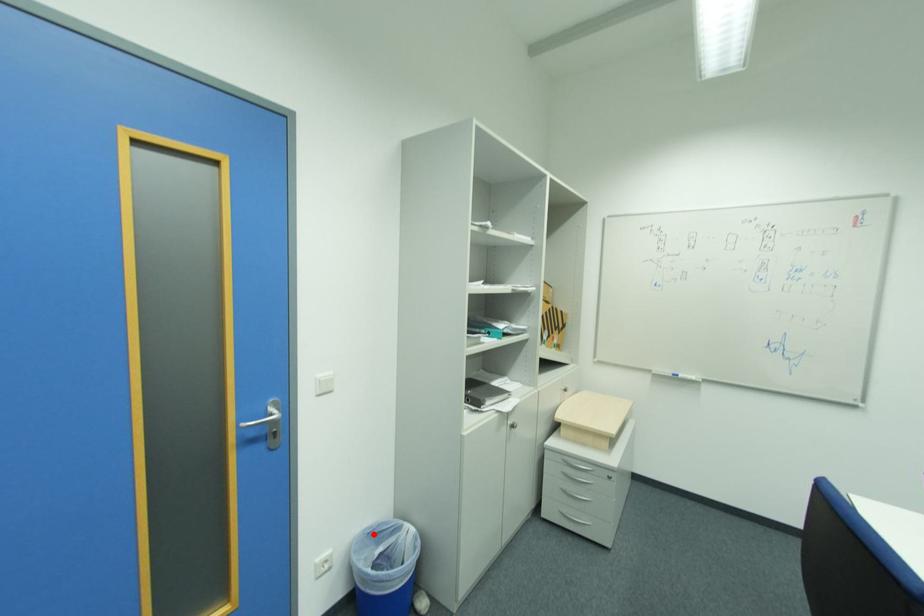
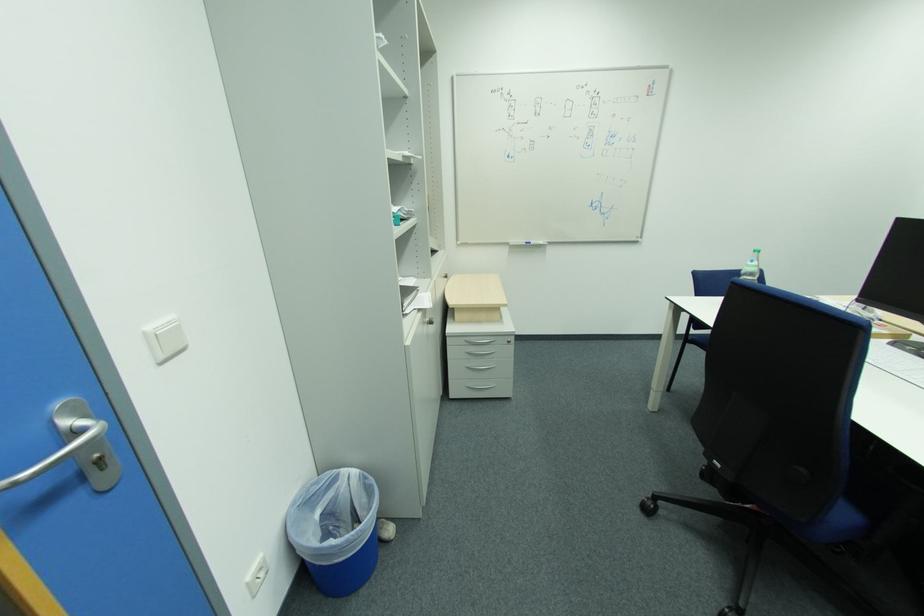
Question: I am providing you with two images of the same scene from different viewpoints. In image1, a red point is highlighted. Considering the same 3D point in image2, which of the following is correct?

Choices:
 (A) It is closer
 (B) It is farther

Answer: (B)